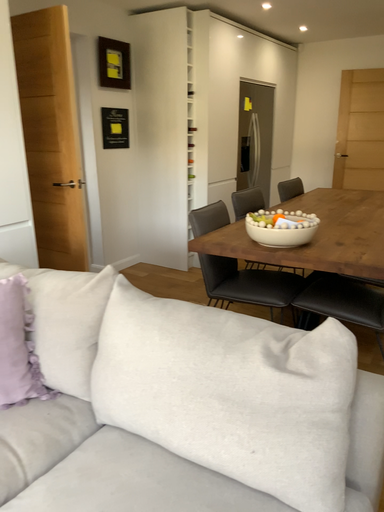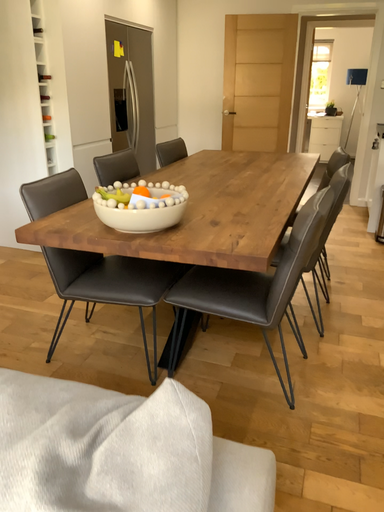
Question: Which way did the camera rotate in the video?

Choices:
 (A) rotated left
 (B) rotated right

Answer: (B)